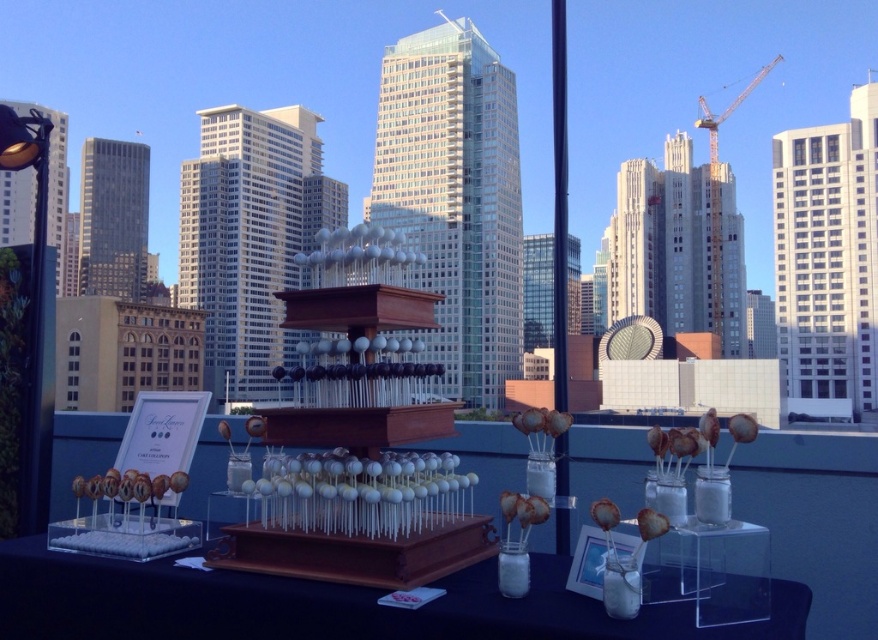
Question: Estimate the real-world distances between objects in this image. Which object is farther from the clear acrylic table at center?

Choices:
 (A) matte chocolate donut at lower left
 (B) white glossy cake pops at center

Answer: (A)

Question: Estimate the real-world distances between objects in this image. Which object is closer to the white glossy cake pops at center?

Choices:
 (A) matte chocolate donut at lower left
 (B) clear acrylic table at center

Answer: (B)

Question: Considering the relative positions of white glossy cake pops at center and matte chocolate donut at lower left in the image provided, where is white glossy cake pops at center located with respect to matte chocolate donut at lower left?

Choices:
 (A) below
 (B) above

Answer: (B)

Question: Can you confirm if clear acrylic table at center is wider than white glossy cake pops at center?

Choices:
 (A) yes
 (B) no

Answer: (B)

Question: Among these points, which one is nearest to the camera?

Choices:
 (A) (85, 481)
 (B) (500, 620)

Answer: (B)

Question: Observing the image, what is the correct spatial positioning of clear acrylic table at center in reference to white glossy cake pops at center?

Choices:
 (A) right
 (B) left

Answer: (A)